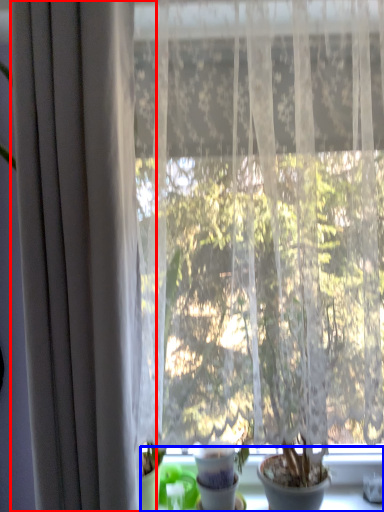
Question: Which point is closer to the camera, curtain (highlighted by a red box) or window sill (highlighted by a blue box)?

Choices:
 (A) curtain
 (B) window sill

Answer: (A)